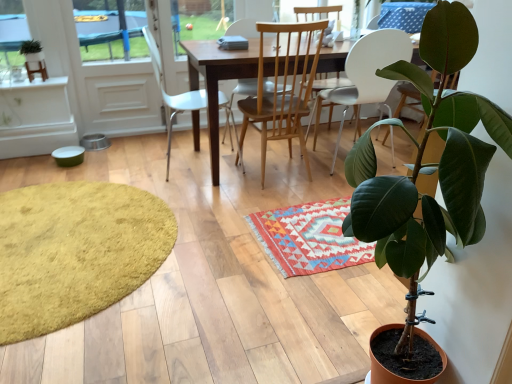
This screenshot has width=512, height=384. In order to click on free space between light wood/wooden chair at center, which is counted as the 2th chair, starting from the right, and multicolored woven rug at center, which appears as the 1th mat when viewed from the right in this screenshot , I will do `click(288, 191)`.